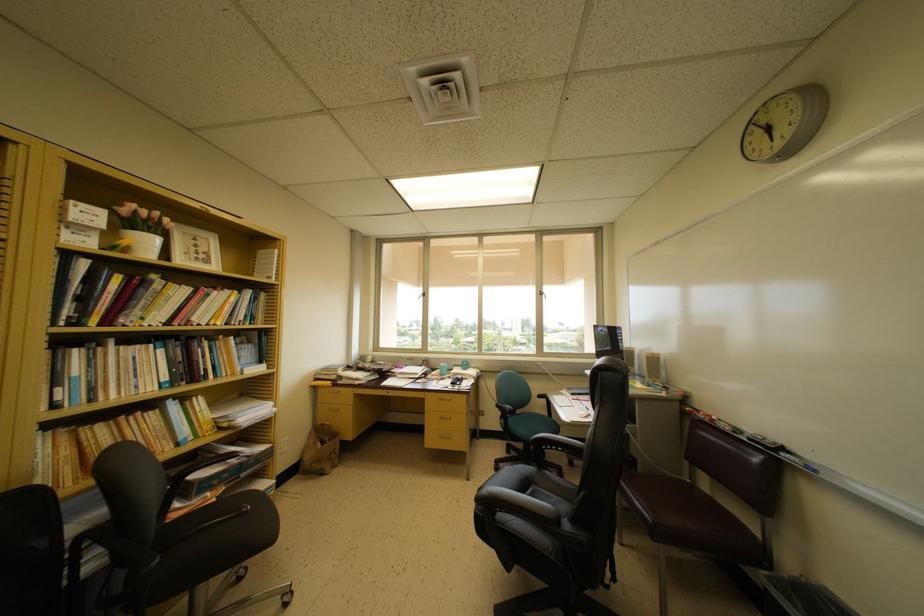
Where is `teal mug`? The height and width of the screenshot is (616, 924). teal mug is located at coordinates tap(465, 363).